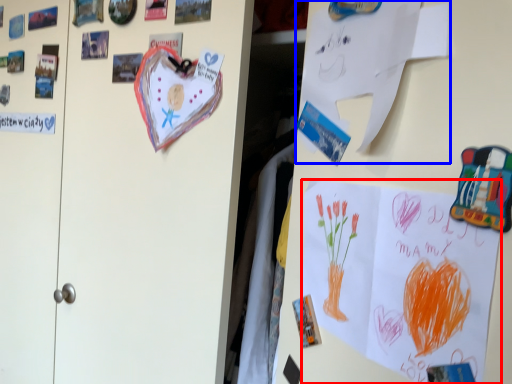
Question: Which object is further to the camera taking this photo, poster (highlighted by a red box) or paper (highlighted by a blue box)?

Choices:
 (A) poster
 (B) paper

Answer: (B)